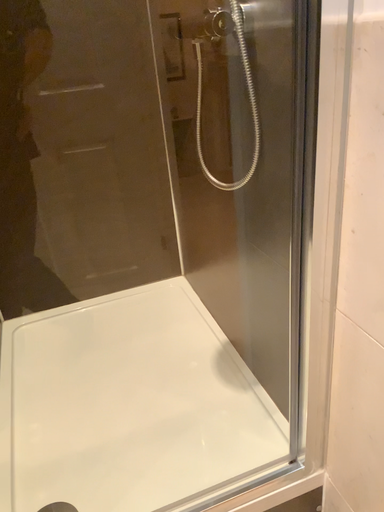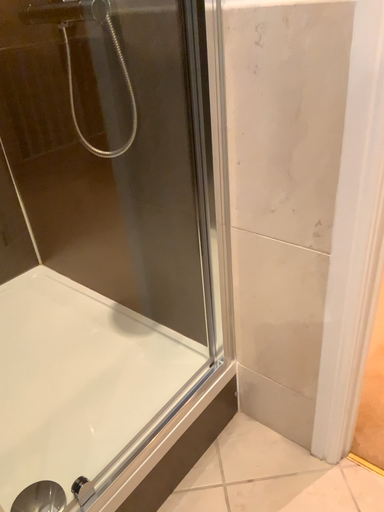
Question: Which way did the camera rotate in the video?

Choices:
 (A) rotated left
 (B) rotated right

Answer: (B)